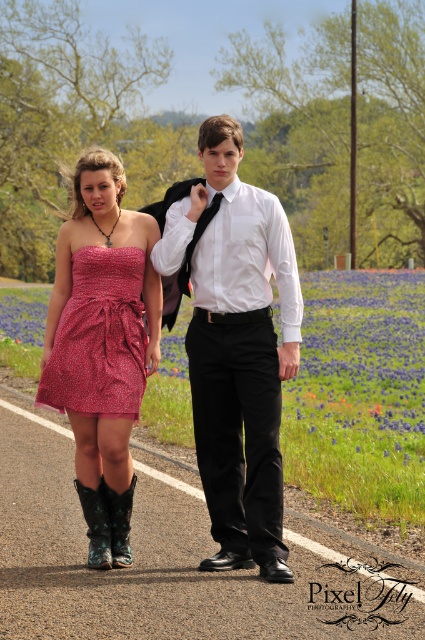
Which is in front, point (93, 492) or point (113, 508)?

Positioned in front is point (93, 492).

This screenshot has height=640, width=425. What do you see at coordinates (96, 525) in the screenshot?
I see `green suede cowboy boot at lower left` at bounding box center [96, 525].

This screenshot has height=640, width=425. Identify the location of green suede cowboy boot at lower left. (96, 525).

Locate an element on the screen. Image resolution: width=425 pixels, height=640 pixels. matte red dress at center is located at coordinates (102, 344).

Is matte red dress at center taller than black satin tie at center?

Yes.

Is point (139, 396) closer to viewer compared to point (189, 253)?

Yes.

Where is `matte red dress at center`? This screenshot has height=640, width=425. matte red dress at center is located at coordinates (102, 344).

Between green suede cowboy boot at lower left and black satin tie at center, which one appears on the left side from the viewer's perspective?

green suede cowboy boot at lower left is more to the left.

Who is more forward, (104, 509) or (189, 275)?

Point (104, 509) is more forward.

Which is in front, point (108, 534) or point (189, 289)?

Positioned in front is point (108, 534).

The image size is (425, 640). I want to click on green suede cowboy boot at lower left, so click(96, 525).